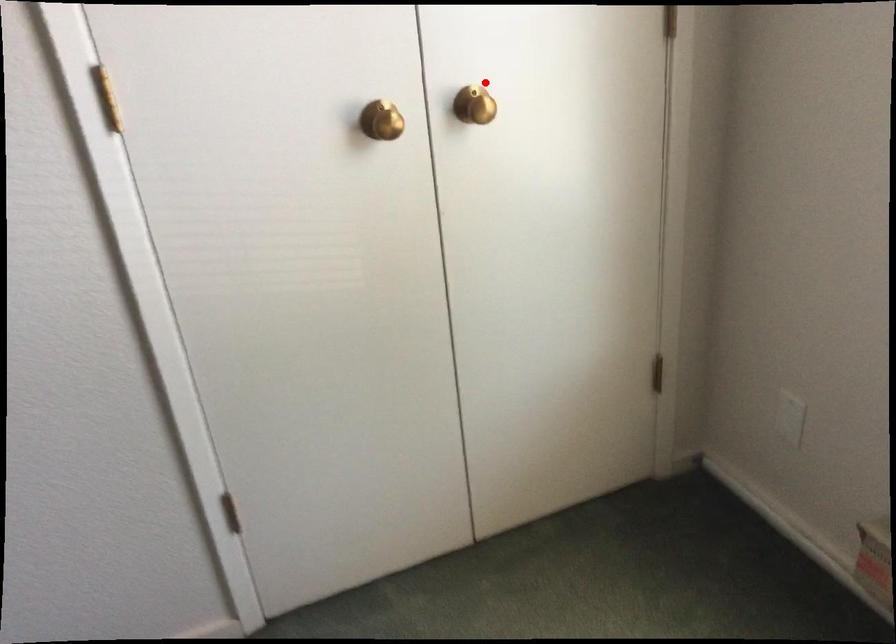
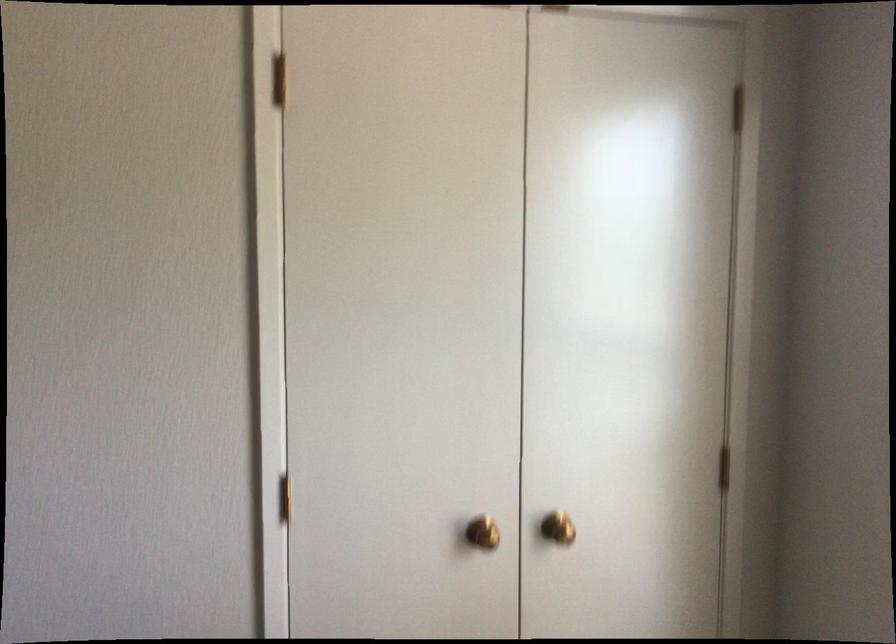
Locate, in the second image, the point that corresponds to the highlighted location in the first image.

(557, 527)